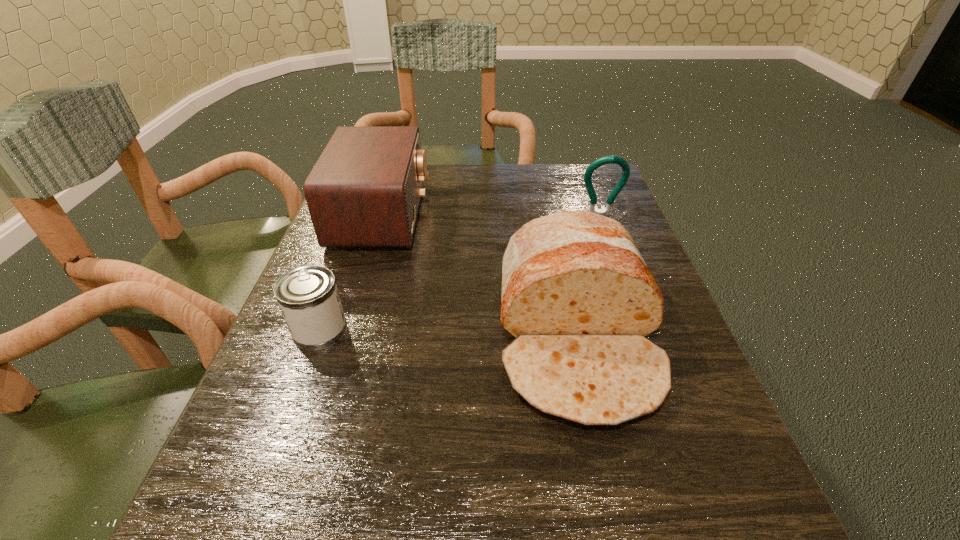
Locate an element on the screen. bread is located at coordinates (577, 296).

Where is `radio receiver`? The image size is (960, 540). radio receiver is located at coordinates (364, 191).

I want to click on bottle opener, so click(620, 161).

In order to click on can in this screenshot , I will do `click(308, 297)`.

What are the coordinates of `free spot located at the sliced end of the bread` in the screenshot? It's located at (619, 534).

Locate an element on the screen. Image resolution: width=960 pixels, height=540 pixels. vacant space located 0.300m on the front panel of the radio receiver is located at coordinates (550, 215).

Locate an element on the screen. This screenshot has height=540, width=960. free location located 0.320m at the jaws of the bottle opener is located at coordinates [637, 319].

Where is `free location located on the back of the shortest object`? This screenshot has width=960, height=540. free location located on the back of the shortest object is located at coordinates (350, 246).

This screenshot has height=540, width=960. Identify the location of object present at the far edge. coord(364,191).

Image resolution: width=960 pixels, height=540 pixels. I want to click on radio receiver located at the left edge, so click(364, 191).